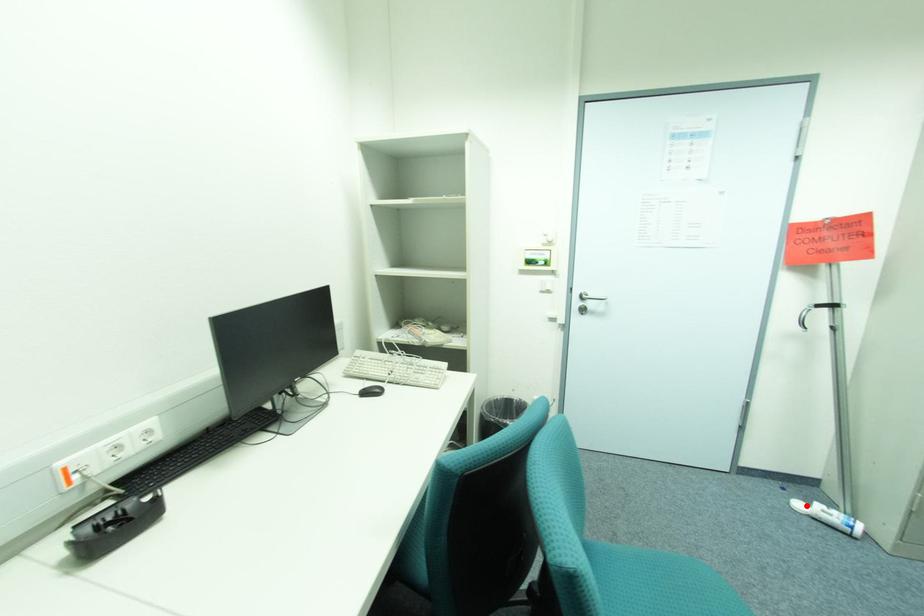
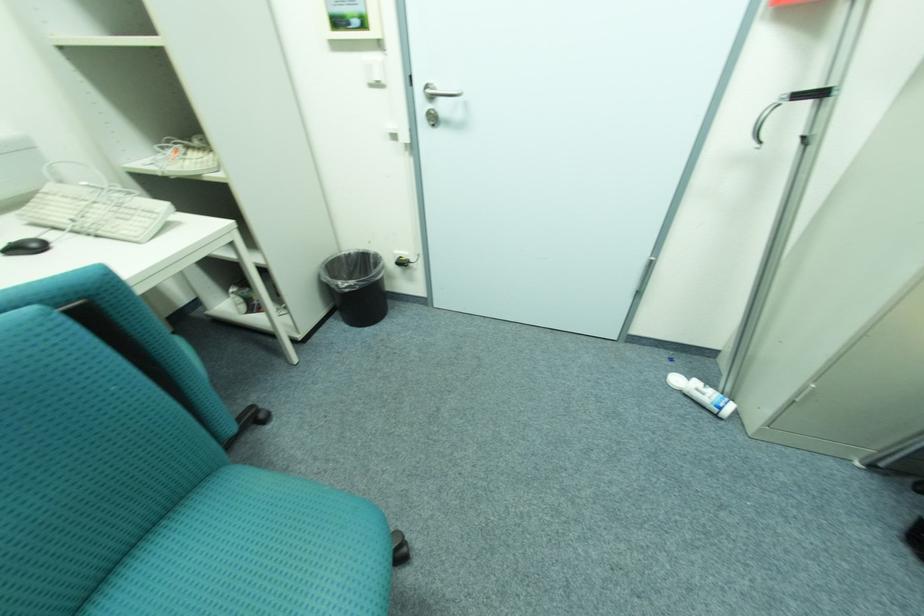
Question: I am providing you with two images of the same scene from different viewpoints. In image1, a red point is highlighted. Considering the same 3D point in image2, which of the following is correct?

Choices:
 (A) It is closer
 (B) It is farther

Answer: (A)